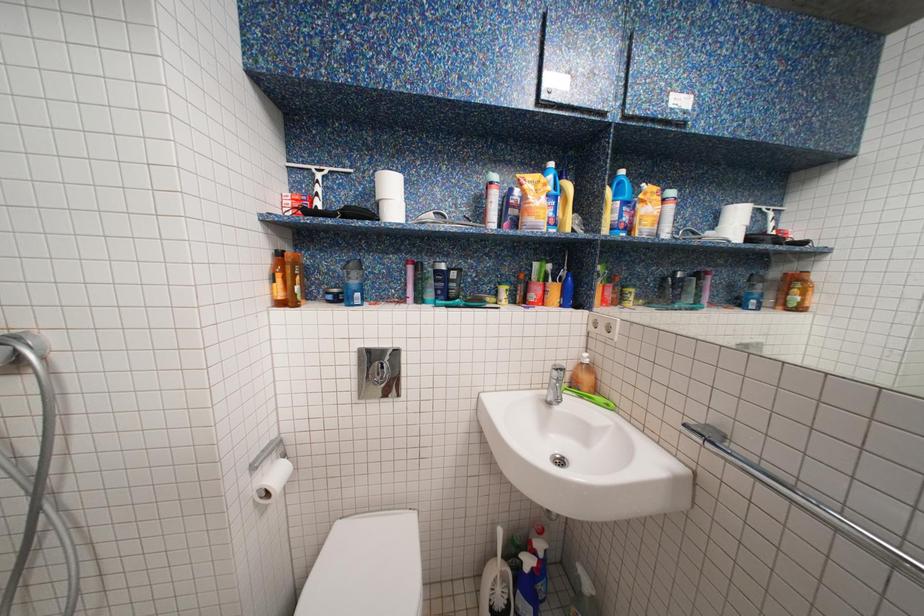
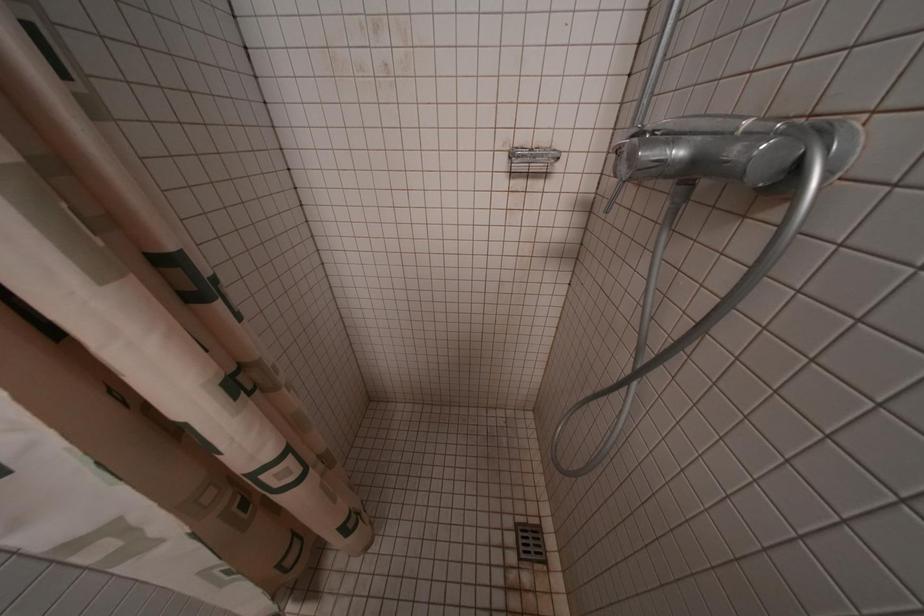
The first image is from the beginning of the video and the second image is from the end. How did the camera likely rotate when shooting the video?

The rotation direction of the camera is left-down.